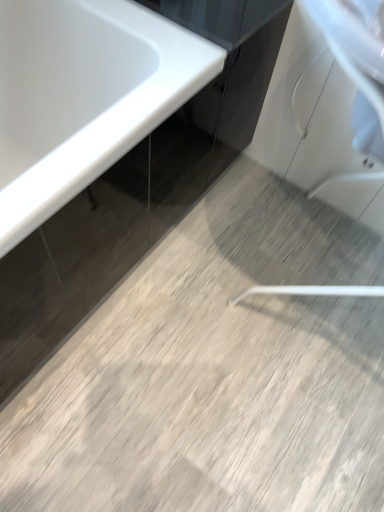
Question: Is glossy black cabinet at upper center located outside white glossy bathtub at upper left?

Choices:
 (A) yes
 (B) no

Answer: (A)

Question: Is glossy black cabinet at upper center wider than white glossy bathtub at upper left?

Choices:
 (A) no
 (B) yes

Answer: (A)

Question: Can you confirm if glossy black cabinet at upper center is smaller than white glossy bathtub at upper left?

Choices:
 (A) no
 (B) yes

Answer: (B)

Question: From the image's perspective, is glossy black cabinet at upper center located beneath white glossy bathtub at upper left?

Choices:
 (A) yes
 (B) no

Answer: (B)

Question: From a real-world perspective, is glossy black cabinet at upper center positioned under white glossy bathtub at upper left based on gravity?

Choices:
 (A) no
 (B) yes

Answer: (A)

Question: Considering the relative sizes of glossy black cabinet at upper center and white glossy bathtub at upper left in the image provided, is glossy black cabinet at upper center shorter than white glossy bathtub at upper left?

Choices:
 (A) yes
 (B) no

Answer: (A)

Question: Is white glossy bathtub at upper left positioned in front of glossy black cabinet at upper center?

Choices:
 (A) yes
 (B) no

Answer: (A)

Question: Is glossy black cabinet at upper center at the back of white glossy bathtub at upper left?

Choices:
 (A) yes
 (B) no

Answer: (B)

Question: Is white glossy bathtub at upper left taller than glossy black cabinet at upper center?

Choices:
 (A) no
 (B) yes

Answer: (B)

Question: Is white glossy bathtub at upper left in contact with glossy black cabinet at upper center?

Choices:
 (A) no
 (B) yes

Answer: (A)

Question: Considering the relative sizes of white glossy bathtub at upper left and glossy black cabinet at upper center in the image provided, is white glossy bathtub at upper left smaller than glossy black cabinet at upper center?

Choices:
 (A) yes
 (B) no

Answer: (B)

Question: Is the depth of white glossy bathtub at upper left greater than that of glossy black cabinet at upper center?

Choices:
 (A) yes
 (B) no

Answer: (B)

Question: Is glossy black cabinet at upper center inside or outside of white glossy bathtub at upper left?

Choices:
 (A) inside
 (B) outside

Answer: (B)